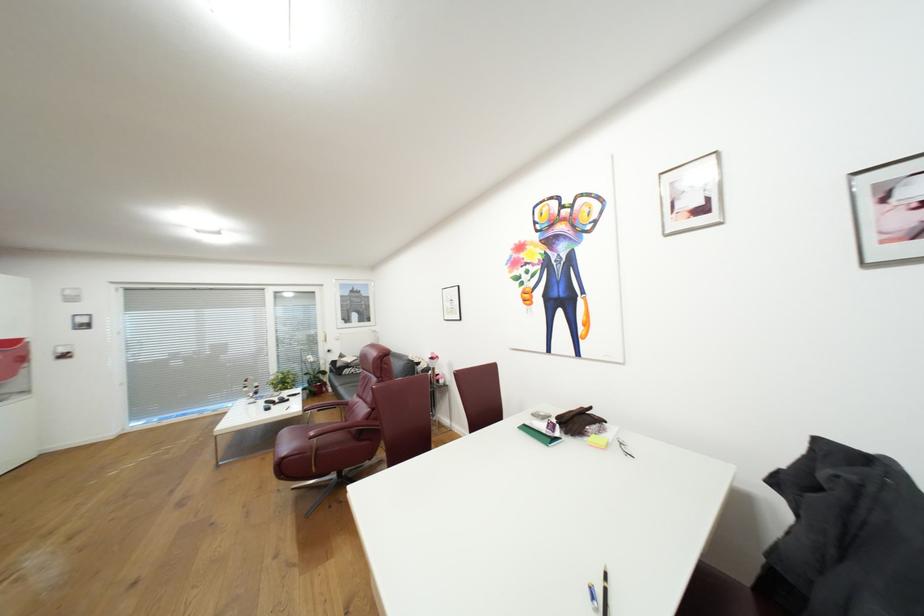
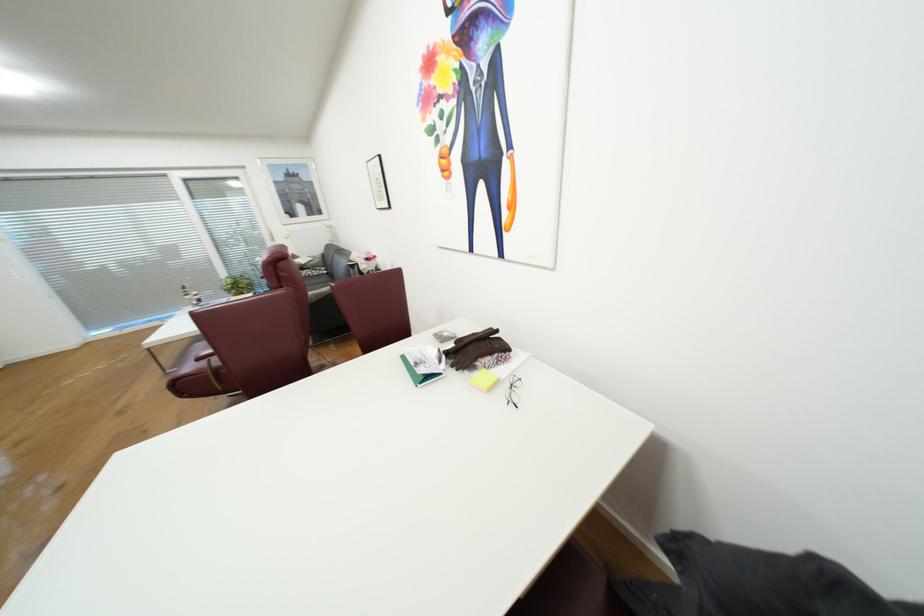
In a continuous first-person perspective shot, in which direction is the camera moving?

The cameraman moved toward right, forward.